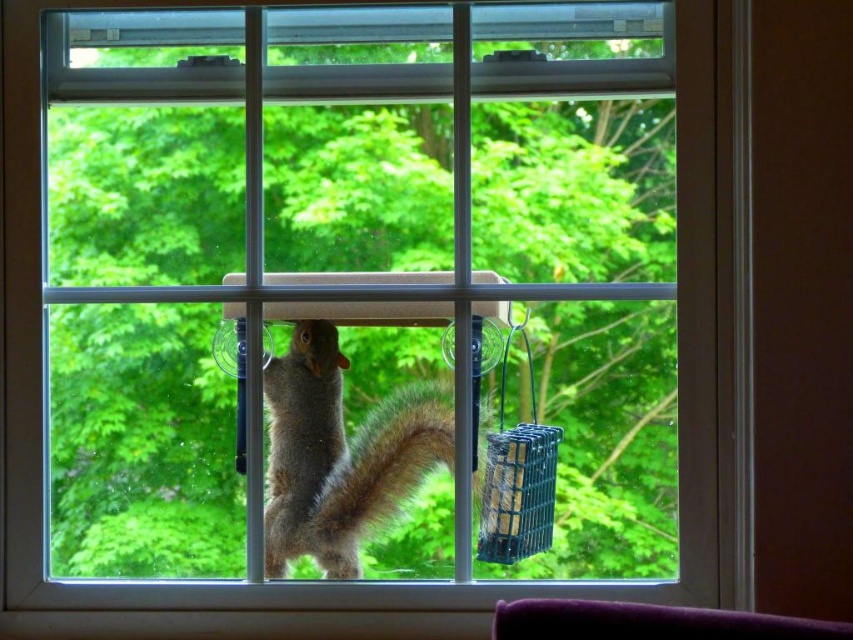
Question: Can you confirm if fuzzy brown squirrel at center is smaller than green plastic bird feeder at right?

Choices:
 (A) no
 (B) yes

Answer: (A)

Question: Among these points, which one is nearest to the camera?

Choices:
 (A) (299, 528)
 (B) (520, 330)

Answer: (B)

Question: Among these objects, which one is nearest to the camera?

Choices:
 (A) green plastic bird feeder at right
 (B) fuzzy brown squirrel at center

Answer: (B)

Question: Considering the relative positions of fuzzy brown squirrel at center and green plastic bird feeder at right in the image provided, where is fuzzy brown squirrel at center located with respect to green plastic bird feeder at right?

Choices:
 (A) right
 (B) left

Answer: (B)

Question: Observing the image, what is the correct spatial positioning of fuzzy brown squirrel at center in reference to green plastic bird feeder at right?

Choices:
 (A) above
 (B) below

Answer: (B)

Question: Which object is farther from the camera taking this photo?

Choices:
 (A) fuzzy brown squirrel at center
 (B) green plastic bird feeder at right

Answer: (B)